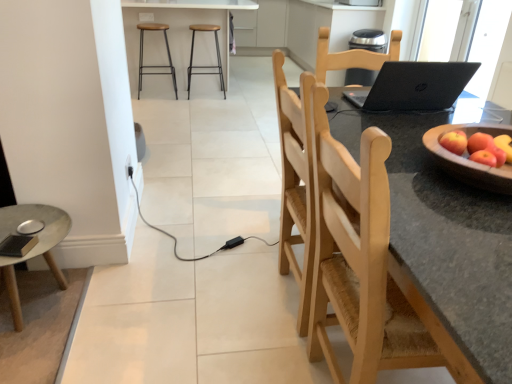
Locate an element on the screen. This screenshot has height=384, width=512. free space in front of wooden stool at center, which appears as the second stool when viewed from the left is located at coordinates (205, 102).